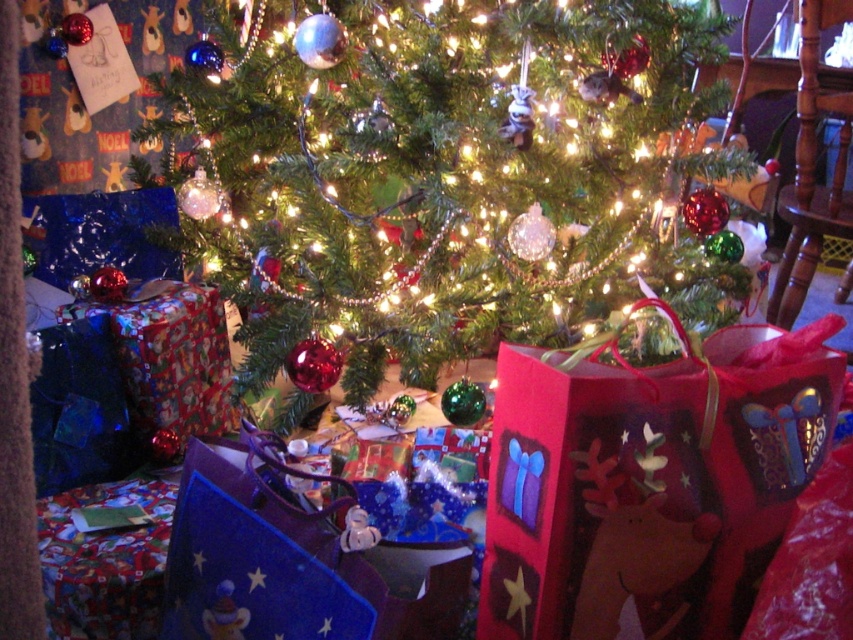
You are a guest at a Christmas party and see the shiny metallic ornaments at center and the red paper bag with reindeer design at lower right. Which one is positioned to the left?

The shiny metallic ornaments at center is positioned to the left of the red paper design at lower right.

You are standing 5 feet away from the Christmas tree and want to reach the shiny metallic ornaments at center. Can you grab them without moving closer?

The shiny metallic ornaments at center are 3.60 feet away from the camera. Since you are standing 5 feet away, you cannot reach them without moving closer.

You are standing in front of the Christmas tree and want to place a decoration. There are two points marked on the tree, one at coordinates point (x=363, y=118) and the other at point (x=612, y=532). Which point is closer to you?

Point (x=363, y=118) is further to the camera than point (x=612, y=532), so the point closer to you is point (x=612, y=532).